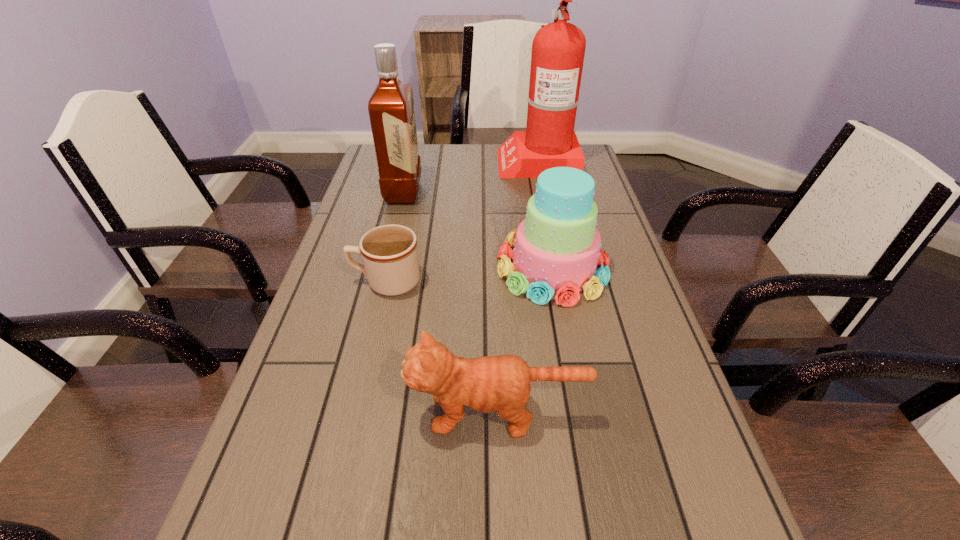
At what (x,y) coordinates should I click in order to perform the action: click on free space located 0.090m on the front-facing side of the farthest object. Please return your answer as a coordinate pair (x, y). The height and width of the screenshot is (540, 960). Looking at the image, I should click on (471, 161).

Image resolution: width=960 pixels, height=540 pixels. I want to click on free space located on the front label of the fourth shortest object, so click(453, 192).

Locate an element on the screen. The width and height of the screenshot is (960, 540). free location located 0.080m on the back of the third shortest object is located at coordinates (542, 215).

Where is `blank space located 0.200m on the face of the nearest object`? The height and width of the screenshot is (540, 960). blank space located 0.200m on the face of the nearest object is located at coordinates (299, 413).

Where is `free space located on the face of the nearest object`? free space located on the face of the nearest object is located at coordinates (272, 413).

Identify the location of vacant region located 0.130m on the face of the nearest object. The width and height of the screenshot is (960, 540). (338, 413).

What are the coordinates of `object that is at the far edge` in the screenshot? It's located at (558, 49).

The height and width of the screenshot is (540, 960). Identify the location of liquor at the left edge. (391, 107).

This screenshot has height=540, width=960. Find the location of `mug situated at the left edge`. mug situated at the left edge is located at coordinates (389, 252).

In order to click on fire extinguisher at the right edge in this screenshot , I will do `click(558, 49)`.